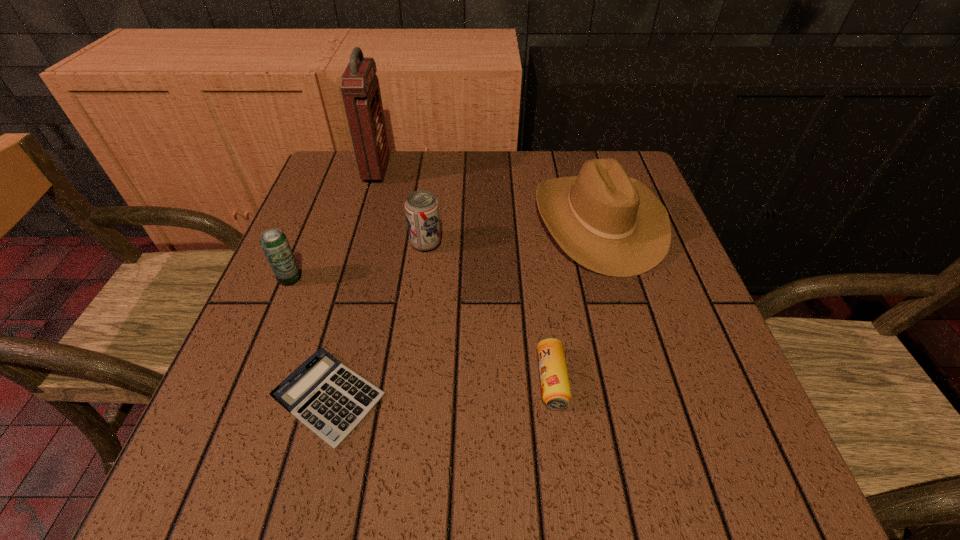
The height and width of the screenshot is (540, 960). I want to click on object that is positioned at the right edge, so click(x=610, y=223).

Where is `object that is at the far left corner`? Image resolution: width=960 pixels, height=540 pixels. object that is at the far left corner is located at coordinates (359, 84).

Locate an element on the screen. This screenshot has width=960, height=540. object positioned at the near left corner is located at coordinates (330, 399).

Find the location of a particular element. object situated at the far right corner is located at coordinates (x=610, y=223).

I want to click on free space at the far edge, so click(x=457, y=183).

The image size is (960, 540). I want to click on vacant region at the near edge of the desktop, so click(x=482, y=481).

Find the location of a particular element. The width and height of the screenshot is (960, 540). free location at the left edge is located at coordinates (246, 371).

Where is `vacant space at the right edge of the desktop`? vacant space at the right edge of the desktop is located at coordinates (655, 375).

Find the location of a particular element. The image size is (960, 540). vacant space at the far left corner is located at coordinates (344, 164).

At what (x,y) coordinates should I click in order to perform the action: click on vacant space at the far right corner of the desktop. Please return your answer as a coordinate pair (x, y). Looking at the image, I should click on (615, 150).